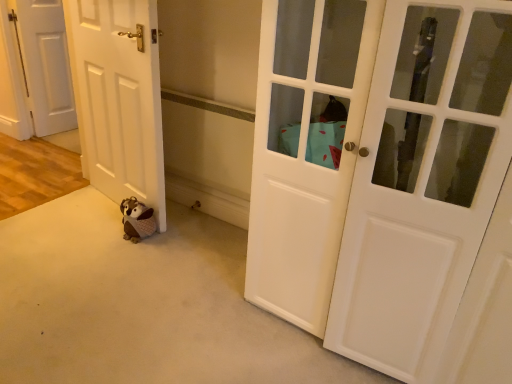
The width and height of the screenshot is (512, 384). Identify the location of vacant space in front of white matte door at left, arranged as the second door when viewed from the front. (95, 255).